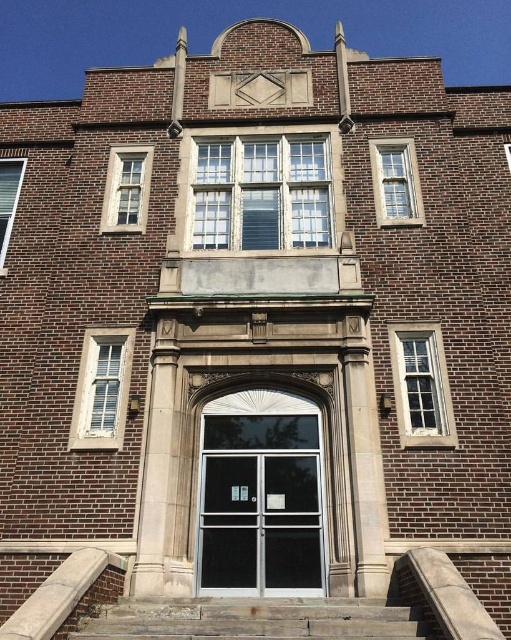
Question: Which of the following is the farthest from the observer?

Choices:
 (A) (218, 618)
 (B) (421, 340)
 (C) (122, 157)
 (D) (310, 209)

Answer: (C)

Question: Can you confirm if clear glass door at center is positioned below clear glass windows at center?

Choices:
 (A) yes
 (B) no

Answer: (A)

Question: Is rusty metal stairs at lower center to the right of matte glass window at upper left from the viewer's perspective?

Choices:
 (A) no
 (B) yes

Answer: (B)

Question: Which point is closer to the camera?

Choices:
 (A) matte glass window at left
 (B) clear glass windows at center

Answer: (B)

Question: Can you confirm if clear glass door at center is positioned to the left of clear glass windows at center?

Choices:
 (A) yes
 (B) no

Answer: (A)

Question: Which of the following is the closest to the observer?

Choices:
 (A) (410, 429)
 (B) (137, 172)
 (C) (127, 394)
 (D) (404, 608)

Answer: (D)